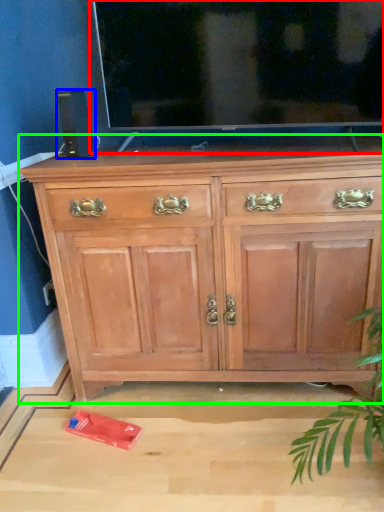
Question: Which object is positioned farthest from glass door (highlighted by a red box)? Select from speaker (highlighted by a blue box) and chest of drawers (highlighted by a green box).

Choices:
 (A) speaker
 (B) chest of drawers

Answer: (B)